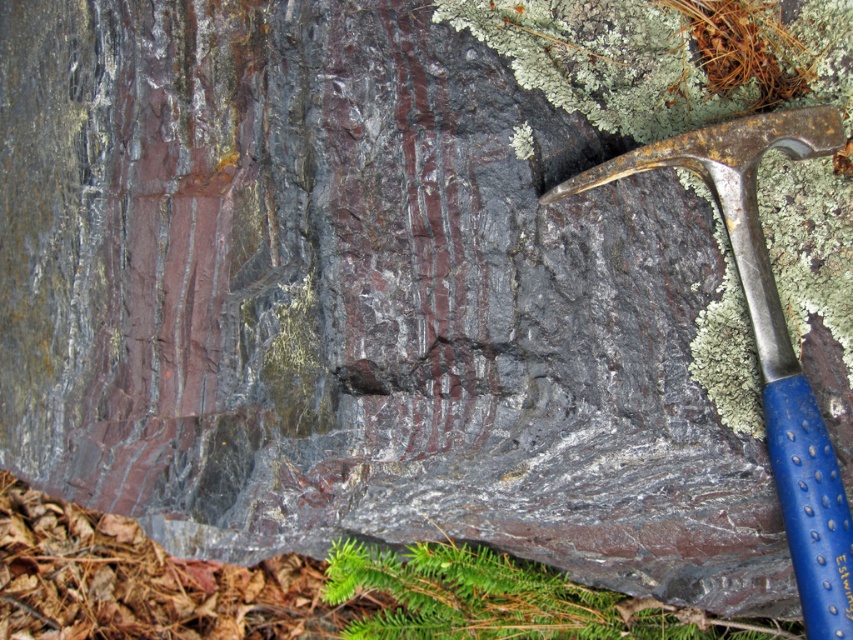
You are a geologist examining the rock surface. You notice two hammers near the rock. Which hammer is taller, the blue plastic hammer at right or the blue rubber hammer at lower right?

The blue plastic hammer at right is taller than the blue rubber hammer at lower right according to the description.